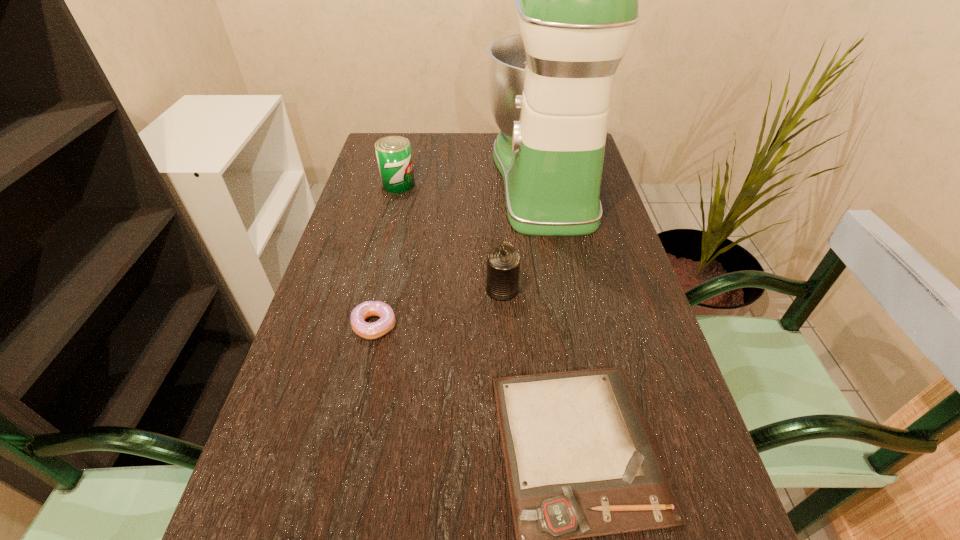
You are a GUI agent. You are given a task and a screenshot of the screen. Output one action in this format:
    pyautogui.click(x=<x>, y=<y>)
    Task: Click on the mixer
    The image size is (960, 540).
    Given the screenshot: What is the action you would take?
    click(x=576, y=0)

Where is `the farther can`? Image resolution: width=960 pixels, height=540 pixels. the farther can is located at coordinates (393, 153).

Find the location of a particular element. This screenshot has height=540, width=960. the third farthest object is located at coordinates pos(503,260).

What are the coordinates of `the right can` in the screenshot? It's located at (503, 260).

At what (x,y) coordinates should I click in order to perform the action: click on the fourth tallest object. Please return your answer as a coordinate pair (x, y). The image size is (960, 540). Looking at the image, I should click on 387,320.

Locate an element on the screen. The image size is (960, 540). the third nearest object is located at coordinates (387, 320).

You are a GUI agent. You are given a task and a screenshot of the screen. Output one action in this format:
    pyautogui.click(x=<x>, y=<y>)
    Task: Click on the vacant space located 0.260m on the controls of the tallest object
    This screenshot has height=540, width=960.
    Given the screenshot: What is the action you would take?
    pyautogui.click(x=403, y=177)

Image resolution: width=960 pixels, height=540 pixels. I want to click on free point located on the controls of the tallest object, so click(400, 177).

Where is `vacant space located on the controls of the tallest object`? The width and height of the screenshot is (960, 540). vacant space located on the controls of the tallest object is located at coordinates (445, 177).

The height and width of the screenshot is (540, 960). I want to click on free spot located on the right of the farther can, so click(x=544, y=184).